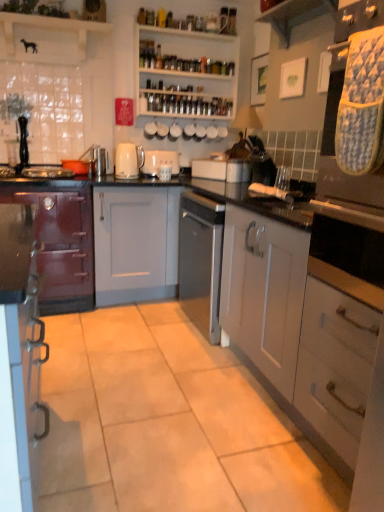
Question: From the image's perspective, relative to white matte cabinet at center, which ranks as the first cabinetry in right-to-left order, is satin silver toaster at center, which is the first appliance from right to left, above or below?

Choices:
 (A) below
 (B) above

Answer: (B)

Question: In terms of height, does satin silver toaster at center, the second appliance when ordered from back to front, look taller or shorter compared to white matte cabinet at center, marked as the 3th cabinetry in a left-to-right arrangement?

Choices:
 (A) tall
 (B) short

Answer: (B)

Question: Which of these objects is positioned closest to the matte gray cabinet at center, which ranks as the 2th cabinetry in right-to-left order?

Choices:
 (A) wooden shelf at upper center, which appears as the first shelf when viewed from the front
 (B) white matte cabinet at center, marked as the 3th cabinetry in a left-to-right arrangement
 (C) matte burgundy cabinet at left, which ranks as the 1th cabinetry in left-to-right order
 (D) white matte toaster at center, which appears as the 2th appliance when ordered from the bottom
 (E) white glossy shelves at upper center, which is the 2th shelf from left to right

Answer: (C)

Question: Based on their relative distances, which object is nearer to the satin silver toaster at center, which is the 2th appliance from left to right?

Choices:
 (A) wooden shelf at upper center, which appears as the first shelf when viewed from the front
 (B) white matte cabinet at center, which ranks as the first cabinetry in right-to-left order
 (C) white matte toaster at center, which appears as the 2th appliance when ordered from the bottom
 (D) matte gray cabinet at center, acting as the second cabinetry starting from the left
 (E) matte burgundy cabinet at left, the third cabinetry positioned from the right

Answer: (C)